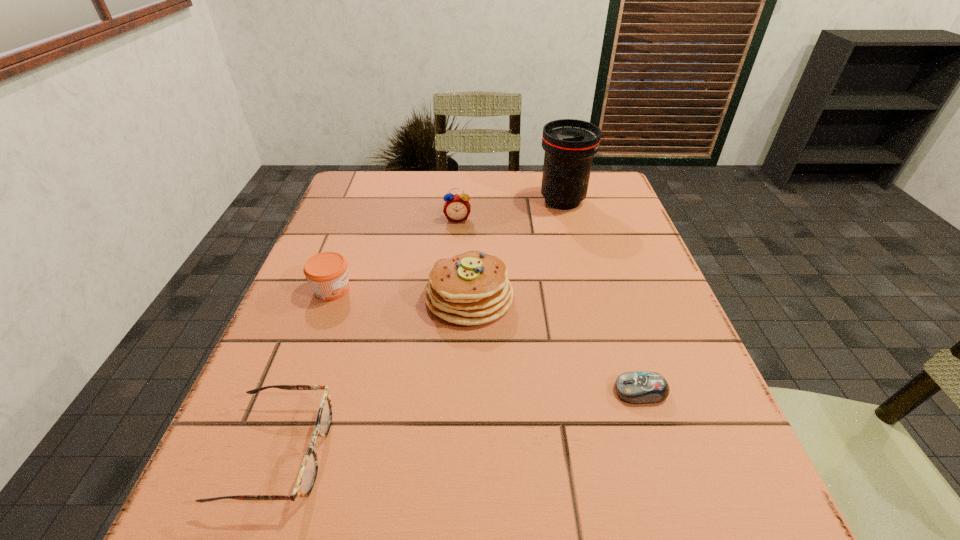
This screenshot has width=960, height=540. In order to click on free space that satisfies the following two spatial constraints: 1. on the front-facing side of the alarm clock; 2. on the front label of the jam in this screenshot , I will do `click(453, 289)`.

This screenshot has width=960, height=540. Identify the location of free space that satisfies the following two spatial constraints: 1. on the front-facing side of the alarm clock; 2. on the right side of the pancake. (452, 296).

Identify the location of vacant region that satisfies the following two spatial constraints: 1. on the front label of the third shortest object; 2. on the left side of the pancake. (329, 296).

The width and height of the screenshot is (960, 540). What are the coordinates of `vacant space that satisfies the following two spatial constraints: 1. on the front label of the jam; 2. on the right side of the pancake` in the screenshot? It's located at (329, 296).

You are a GUI agent. You are given a task and a screenshot of the screen. Output one action in this format:
    pyautogui.click(x=<x>, y=<y>)
    Task: Click on the vacant point that satisfies the following two spatial constraints: 1. on the front-facing side of the pancake; 2. on the left side of the alarm clock
    
    Given the screenshot: What is the action you would take?
    (x=452, y=296)